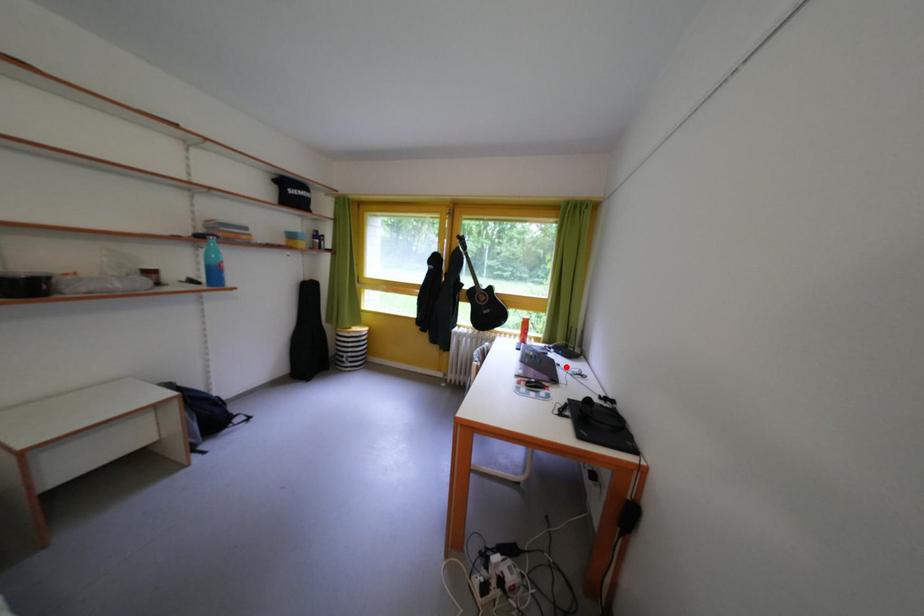
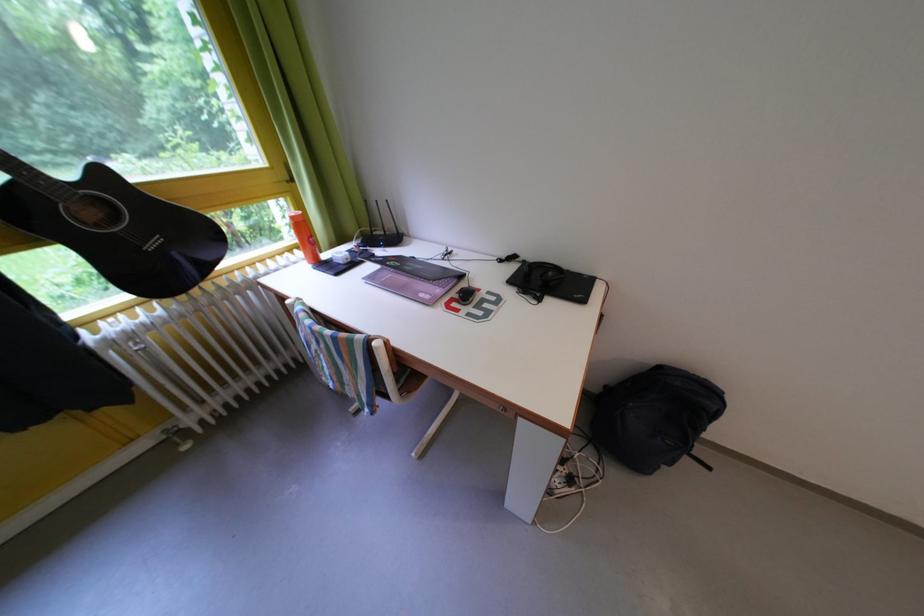
Question: I am providing you with two images of the same scene from different viewpoints. A red point is shown in image1. For the corresponding object point in image2, is it positioned nearer or farther from the camera?

Choices:
 (A) Nearer
 (B) Farther

Answer: (B)